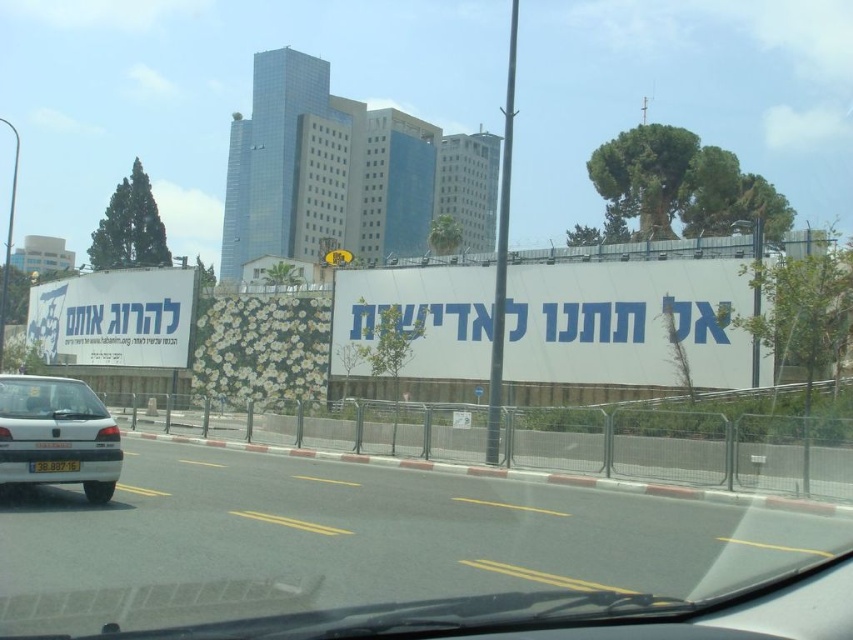
Question: Which object is the closest to the gray asphalt highway at center?

Choices:
 (A) white paperboard billboard at left
 (B) silver metallic car at left

Answer: (B)

Question: Considering the relative positions of white paperboard billboard at left and yellow plastic license plate at center in the image provided, where is white paperboard billboard at left located with respect to yellow plastic license plate at center?

Choices:
 (A) below
 (B) above

Answer: (B)

Question: Which of these objects is positioned farthest from the white paperboard billboard at left?

Choices:
 (A) transparent glass windshield at lower left
 (B) yellow plastic license plate at center

Answer: (A)

Question: Does silver metallic car at left have a smaller size compared to transparent glass windshield at lower left?

Choices:
 (A) yes
 (B) no

Answer: (B)

Question: Is white paper billboard at center to the right of white paperboard billboard at left from the viewer's perspective?

Choices:
 (A) no
 (B) yes

Answer: (B)

Question: Considering the real-world distances, which object is closest to the gray asphalt highway at center?

Choices:
 (A) silver metallic car at left
 (B) white paperboard billboard at left
 (C) yellow plastic license plate at center

Answer: (C)